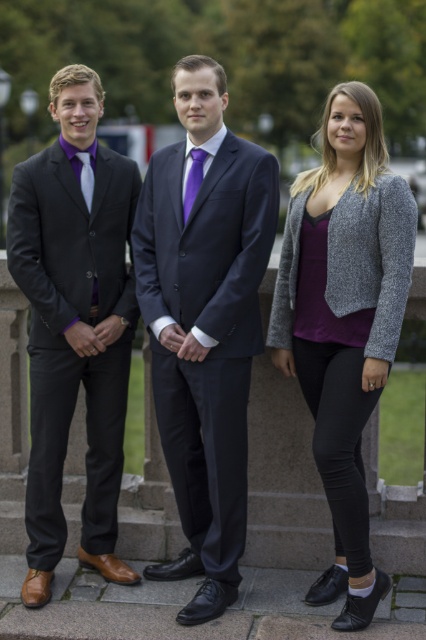
You are standing at the point labeled point [74,324] in the image. Which object from the scene are you currently touching?

You are touching the matte black suit at left because the point [74,324] is located on it.